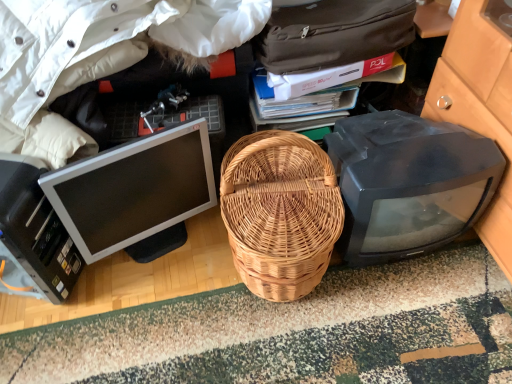
Identify the location of vacant area that is situated to the right of black plastic printer at lower left. The image size is (512, 384). 125,306.